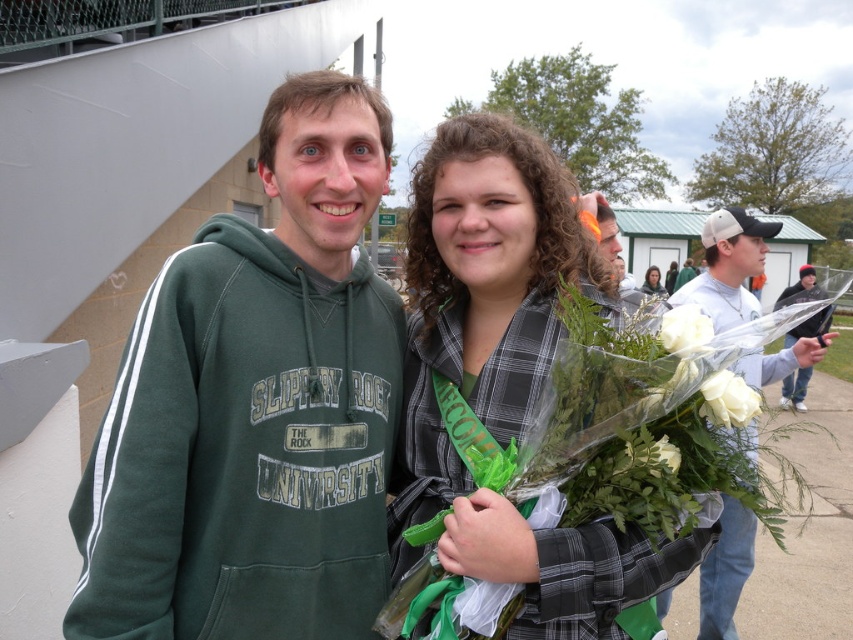
From the picture: You are standing at the point marked as point (653, 272) in the image. You want to walk directly to the nearest exit, which is 20 meters away from you. Can you reach the exit before the person holding the bouquet of flowers wrapped in clear plastic, who is currently 25 meters away from the exit?

The point marked as point (653, 272) is 18.85 meters away from the viewer. The exit is 20 meters away from the point, so the total distance from the viewer to the exit is 18.85 meters plus 20 meters, totaling 38.85 meters. The person with the bouquet is 25 meters away from the exit, so they have a shorter distance to cover. Therefore, the person with the bouquet will reach the exit before you.

You are a photographer trying to capture the green plaid scarf at center in the image. The camera you are using has a focus point at coordinate point (653,282). Will this focus point successfully capture the green plaid scarf at center?

Yes, the focus point at (653,282) is positioned on the green plaid scarf at center, so it will successfully capture the green plaid scarf at center.

You are taking a photo of the two people in the image. Which person, the green plaid shirt at center or the matte green hoodie at center, is positioned closer to the camera?

The green plaid shirt at center is closer to the viewer than the matte green hoodie at center, so the green plaid shirt at center is positioned closer to the camera.